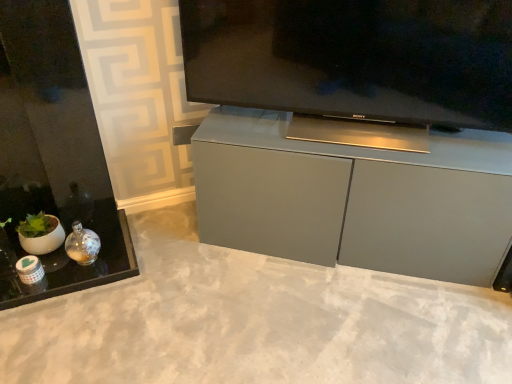
Question: In the image, is matte gray concrete at center positioned in front of or behind satin silver television at center?

Choices:
 (A) front
 (B) behind

Answer: (A)

Question: Is matte gray concrete at center wider or thinner than satin silver television at center?

Choices:
 (A) wide
 (B) thin

Answer: (A)

Question: Estimate the real-world distances between objects in this image. Which object is farther from the satin silver television at center?

Choices:
 (A) matte gray cabinet at center
 (B) matte gray concrete at center

Answer: (B)

Question: Considering the real-world distances, which object is farthest from the matte gray cabinet at center?

Choices:
 (A) matte gray concrete at center
 (B) satin silver television at center

Answer: (A)